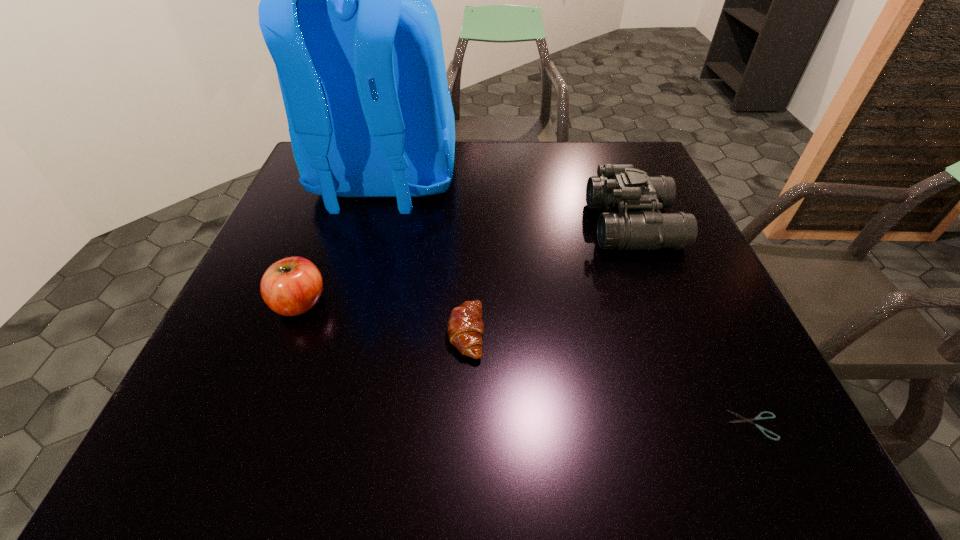
At what (x,y) coordinates should I click in order to perform the action: click on vacant space located through the lenses of the binoculars. Please return your answer as a coordinate pair (x, y). This screenshot has height=540, width=960. Looking at the image, I should click on (492, 225).

At what (x,y) coordinates should I click in order to perform the action: click on blank area located 0.160m on the back of the apple. Please return your answer as a coordinate pair (x, y). Looking at the image, I should click on (326, 235).

Find the location of a particular element. The height and width of the screenshot is (540, 960). free space located 0.210m on the left of the third object from right to left is located at coordinates (337, 333).

Where is `free region located 0.300m on the back of the shortest object`? The height and width of the screenshot is (540, 960). free region located 0.300m on the back of the shortest object is located at coordinates (686, 280).

At what (x,y) coordinates should I click in order to perform the action: click on object present at the far edge. Please return your answer as a coordinate pair (x, y). Looking at the image, I should click on (346, 14).

In order to click on object present at the near edge in this screenshot , I will do `click(758, 417)`.

The width and height of the screenshot is (960, 540). I want to click on backpack at the left edge, so click(x=346, y=14).

Where is `apple at the left edge`? The height and width of the screenshot is (540, 960). apple at the left edge is located at coordinates (291, 286).

Find the location of `binoculars situated at the right edge`. binoculars situated at the right edge is located at coordinates (622, 188).

Where is `shears present at the right edge`? The height and width of the screenshot is (540, 960). shears present at the right edge is located at coordinates (758, 417).